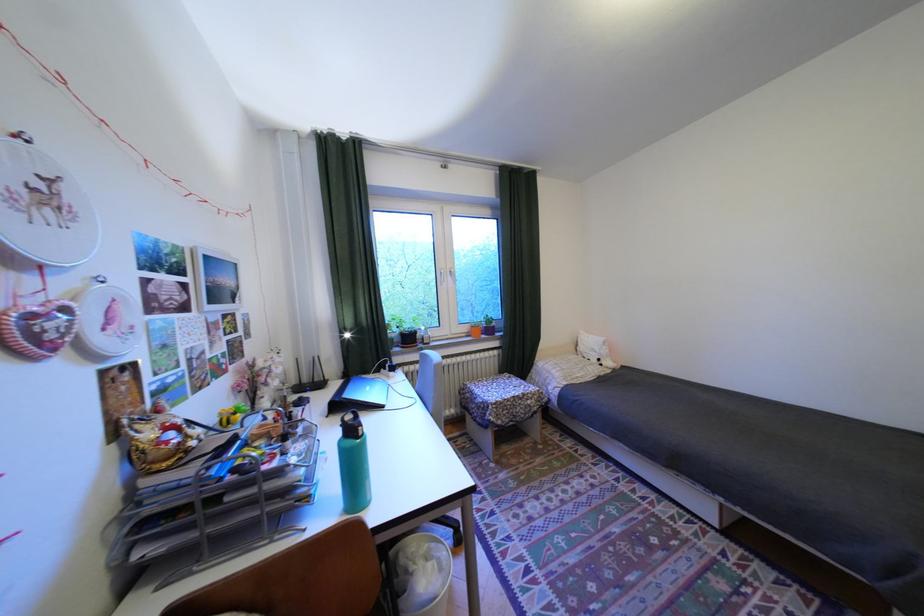
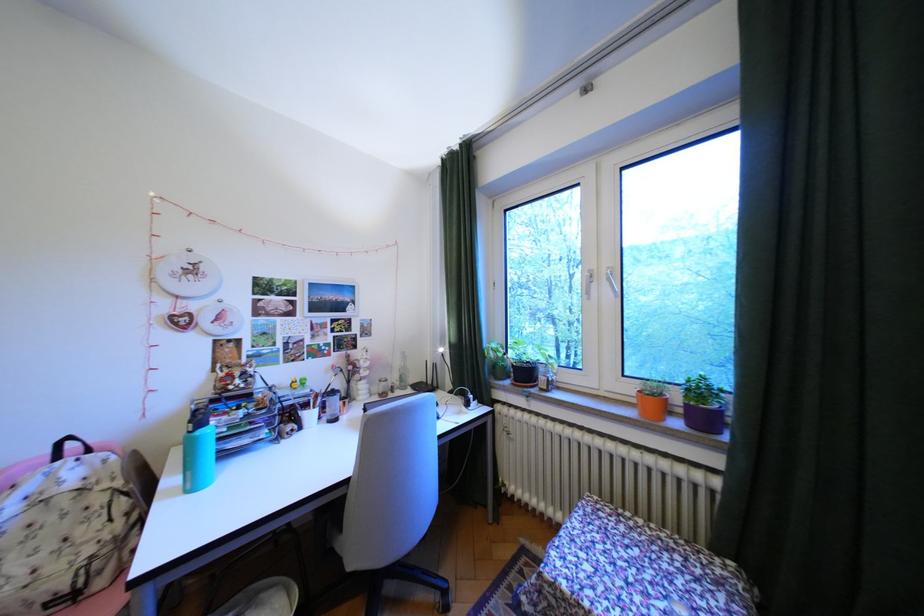
In the second image, find the point that corresponds to [507,403] in the first image.

(564, 585)